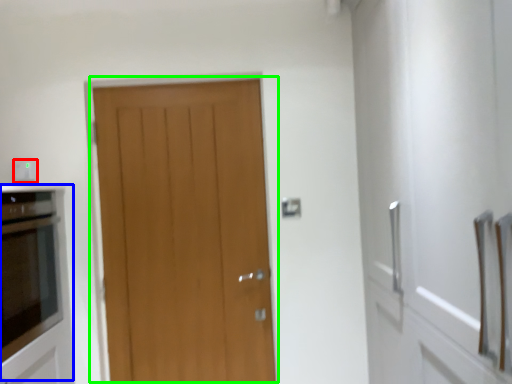
Question: Which object is the farthest from electric outlet (highlighted by a red box)? Choose among these: appliance (highlighted by a blue box) or door (highlighted by a green box).

Choices:
 (A) appliance
 (B) door

Answer: (B)